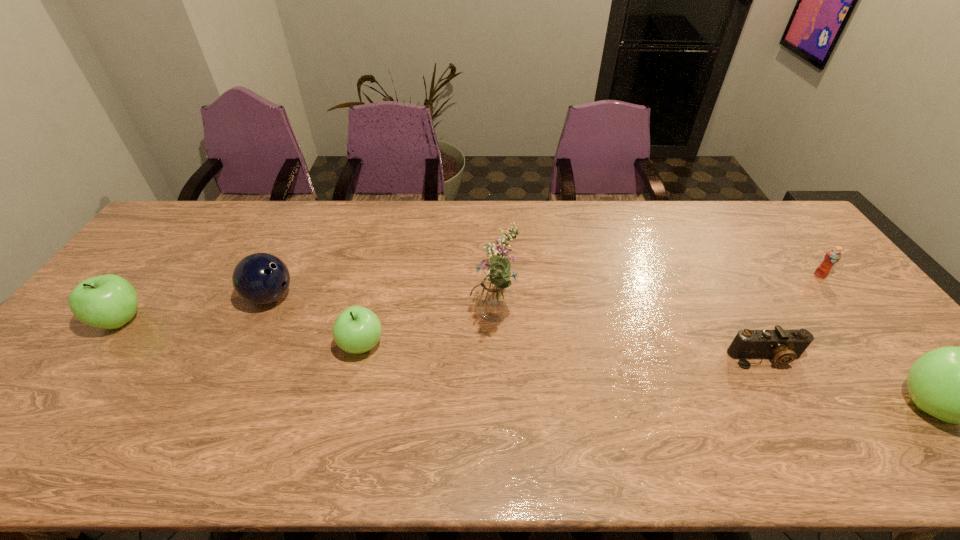
In order to click on object that is the second closest to the rightmost apple in this screenshot , I will do `click(833, 256)`.

Find the location of `the fourth closest object to the shortest apple`. the fourth closest object to the shortest apple is located at coordinates (784, 346).

Select which apple is the second closest to the nearest object. Please provide its 2D coordinates. Your answer should be formatted as a tuple, i.e. [(x, y)], where the tuple contains the x and y coordinates of a point satisfying the conditions above.

[(109, 301)]

Point out which apple is positioned as the third nearest to the farthest object. Please provide its 2D coordinates. Your answer should be formatted as a tuple, i.e. [(x, y)], where the tuple contains the x and y coordinates of a point satisfying the conditions above.

[(109, 301)]

Where is `vacant space that satisfies the following two spatial constraints: 1. on the surface of the second object from left to right near the finger holes; 2. on the left side of the second apple from right to left`? The image size is (960, 540). vacant space that satisfies the following two spatial constraints: 1. on the surface of the second object from left to right near the finger holes; 2. on the left side of the second apple from right to left is located at coordinates click(x=248, y=346).